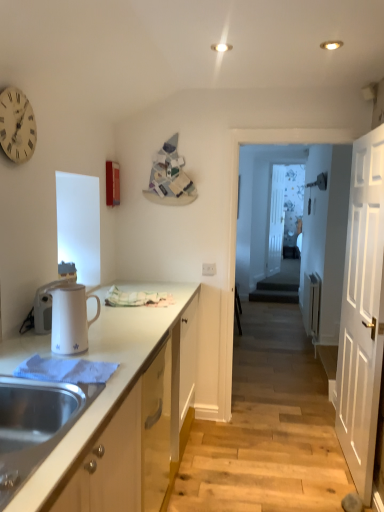
Question: From a real-world perspective, is transparent glass door at center, arranged as the 1th glass door when viewed from the front, under white glossy electric kettle at left, the 2th appliance from the right?

Choices:
 (A) yes
 (B) no

Answer: (B)

Question: Does transparent glass door at center, arranged as the 1th glass door when viewed from the front, have a lesser height compared to white glossy electric kettle at left, the 2th appliance from the right?

Choices:
 (A) no
 (B) yes

Answer: (A)

Question: Would you say transparent glass door at center, arranged as the 1th glass door when viewed from the front, is a long distance from white glossy electric kettle at left, the second appliance in the front-to-back sequence?

Choices:
 (A) no
 (B) yes

Answer: (B)

Question: Is transparent glass door at center, arranged as the 1th glass door when viewed from the front, taller than white glossy electric kettle at left, which is counted as the first appliance, starting from the back?

Choices:
 (A) no
 (B) yes

Answer: (B)

Question: Considering the relative sizes of transparent glass door at center, which appears as the second glass door when viewed from the back, and white glossy electric kettle at left, the 2th appliance from the right, in the image provided, is transparent glass door at center, which appears as the second glass door when viewed from the back, wider than white glossy electric kettle at left, the 2th appliance from the right,?

Choices:
 (A) no
 (B) yes

Answer: (B)

Question: Is white glossy electric kettle at left, the second appliance in the front-to-back sequence, at the back of transparent glass door at center, arranged as the 1th glass door when viewed from the front?

Choices:
 (A) no
 (B) yes

Answer: (A)

Question: Considering the relative sizes of white wooden door at right and transparent glass door at center, arranged as the 1th glass door when viewed from the front, in the image provided, is white wooden door at right bigger than transparent glass door at center, arranged as the 1th glass door when viewed from the front,?

Choices:
 (A) no
 (B) yes

Answer: (B)

Question: Is white wooden door at right to the right of transparent glass door at center, which appears as the second glass door when viewed from the back, from the viewer's perspective?

Choices:
 (A) yes
 (B) no

Answer: (B)

Question: Is white wooden door at right directly adjacent to transparent glass door at center, arranged as the 1th glass door when viewed from the front?

Choices:
 (A) yes
 (B) no

Answer: (B)

Question: From the image's perspective, would you say white wooden door at right is positioned over transparent glass door at center, arranged as the 1th glass door when viewed from the front?

Choices:
 (A) yes
 (B) no

Answer: (B)

Question: Does white wooden door at right have a lesser width compared to transparent glass door at center, arranged as the 1th glass door when viewed from the front?

Choices:
 (A) no
 (B) yes

Answer: (B)

Question: Considering the relative sizes of white wooden door at right and transparent glass door at center, arranged as the 1th glass door when viewed from the front, in the image provided, is white wooden door at right wider than transparent glass door at center, arranged as the 1th glass door when viewed from the front,?

Choices:
 (A) yes
 (B) no

Answer: (B)

Question: Does white wooden clock at upper left have a lesser width compared to white wooden door at right?

Choices:
 (A) no
 (B) yes

Answer: (B)